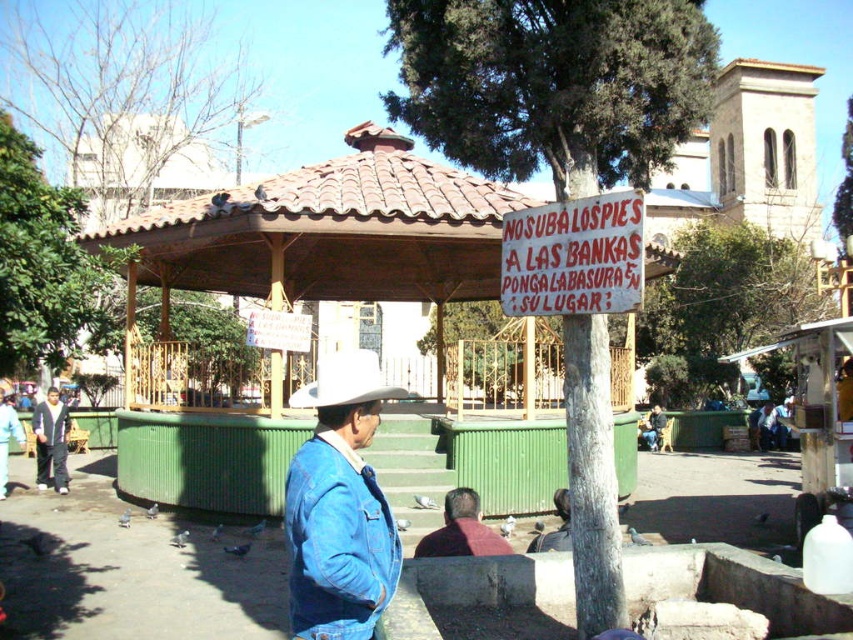
You are standing at the gazebo and want to throw food to the pigeons. You have two pieces of bread. One is at point (352,392) and the other is at point (451,500). Which piece of bread is closer to you?

The piece of bread at point (352,392) is closer to you because it is nearer than the other point.

You are standing in the plaza and see two denim jackets. The blue denim jacket at center and the denim jacket at left. Which one is shorter?

The blue denim jacket at center is shorter than the denim jacket at left.

You are a city planner assessing the plaza for safety. You see the brown wood gazebo at center and the denim jacket at left. Which object takes up more horizontal space in the plaza?

The brown wood gazebo at center is wider than the denim jacket at left, so it takes up more horizontal space in the plaza.